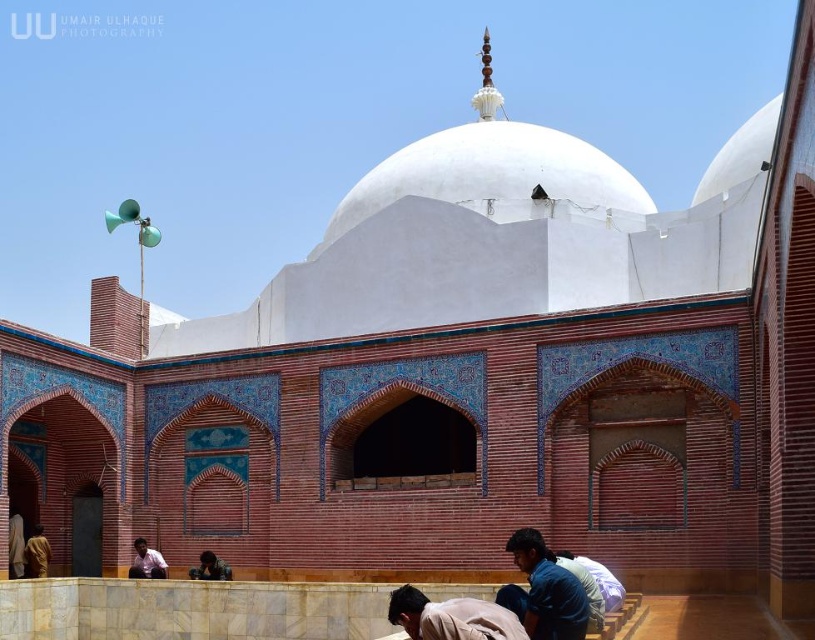
You are a visitor standing in front of the mosque and notice two light brown items. One is the light brown fabric at lower center and the other is the light brown shirt at lower left. Which item is covering part of the other?

The light brown fabric at lower center is positioned over the light brown shirt at lower left, so it is covering part of the shirt.

You are standing in front of the mosque and notice two points marked on the wall. The first point is at coordinates point (408, 584) and the second is at point (223, 572). Which point is closer to you?

Point (408, 584) is in front of point (223, 572), so it is closer to you.